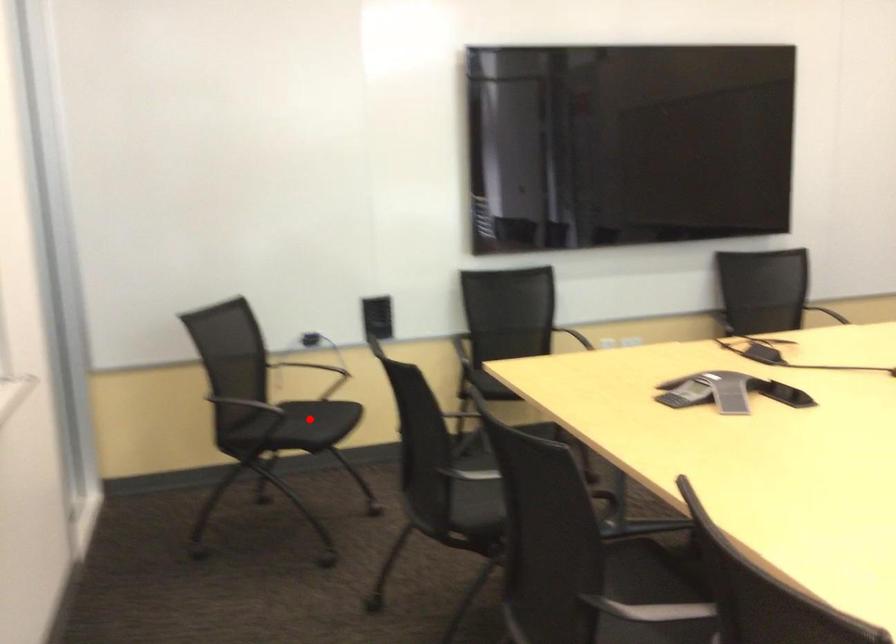
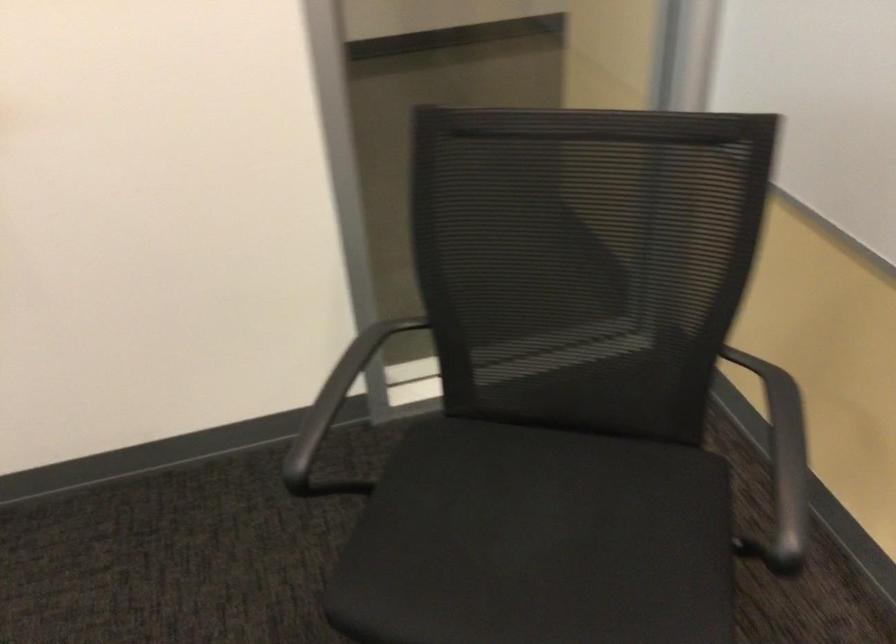
Question: I am providing you with two images of the same scene from different viewpoints. A red point is shown in image1. For the corresponding object point in image2, is it positioned nearer or farther from the camera?

Choices:
 (A) Nearer
 (B) Farther

Answer: (A)